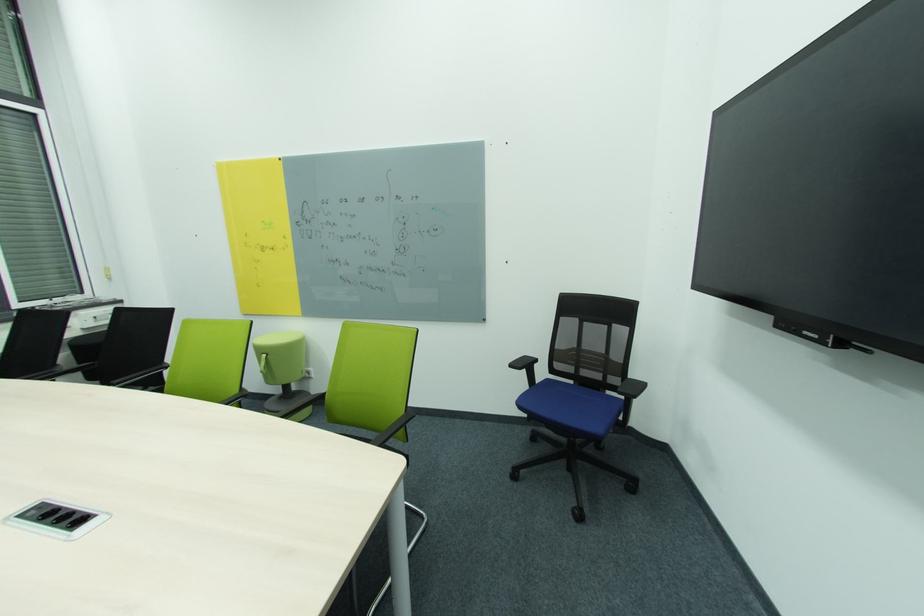
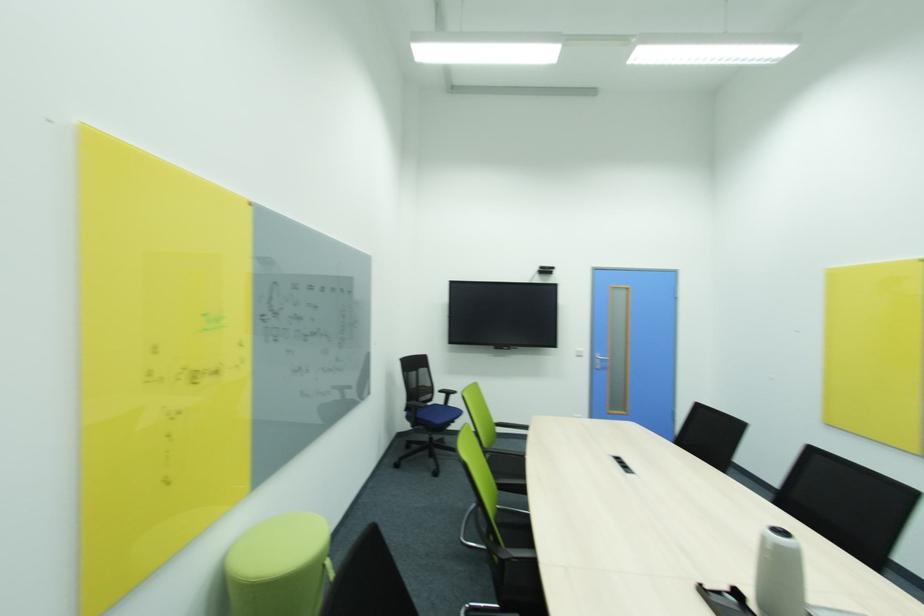
The point at [624,331] is marked in the first image. Where is the corresponding point in the second image?

(428, 371)